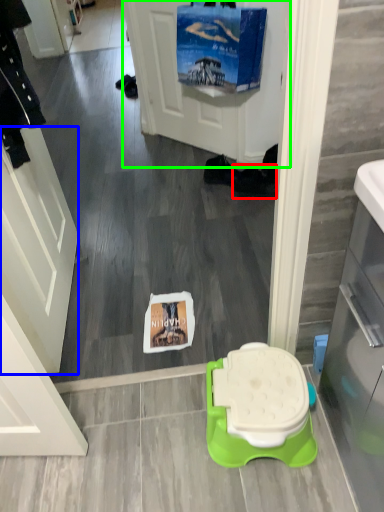
Question: Which object is the farthest from footwear (highlighted by a red box)? Choose among these: screen door (highlighted by a blue box) or screen door (highlighted by a green box).

Choices:
 (A) screen door
 (B) screen door

Answer: (A)